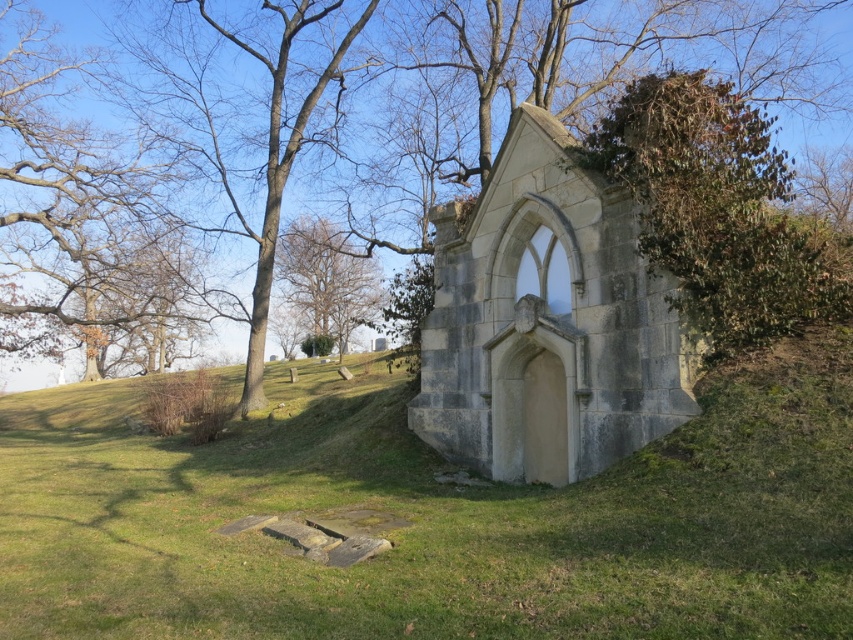
You are standing at the point marked by the coordinates point (70, 205) in the image, which is the location of the brown leafy tree at upper left. You want to walk towards the chapel. In which direction should you head relative to your current position?

You should head towards the lower right direction relative to your current position at point (70, 205), as the chapel is situated lower right from the brown leafy tree at upper left.

You are standing at the point marked as point [322,132] in the image. What object is located at this point?

The point [322,132] corresponds to the green leafy tree at center.